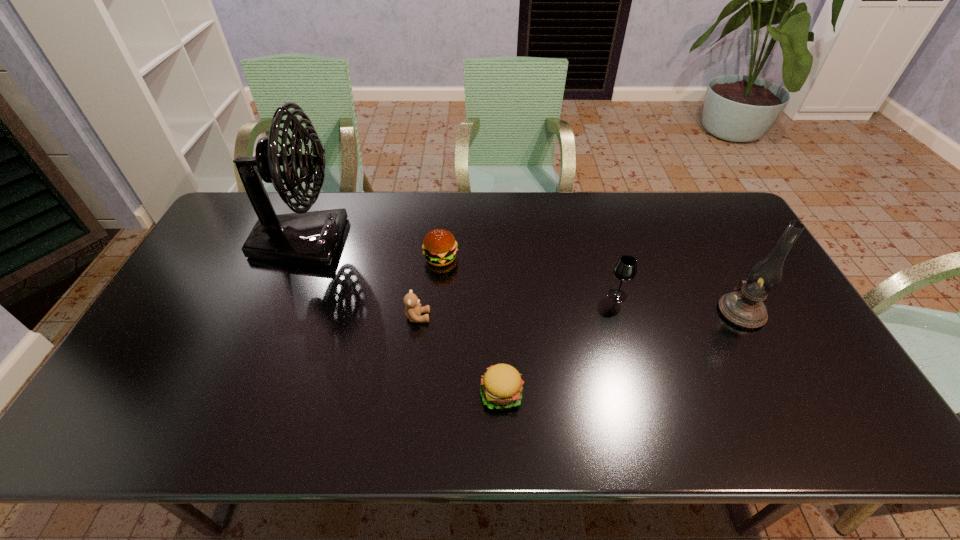
This screenshot has width=960, height=540. Find the location of `vacant area in the image that satisfies the following two spatial constraints: 1. in front of the shortest object to blow air; 2. on the left side of the tallest object`. vacant area in the image that satisfies the following two spatial constraints: 1. in front of the shortest object to blow air; 2. on the left side of the tallest object is located at coordinates (237, 393).

Where is `free point that satisfies the following two spatial constraints: 1. on the front-facing side of the teddy bear; 2. on the right side of the shortest object`? free point that satisfies the following two spatial constraints: 1. on the front-facing side of the teddy bear; 2. on the right side of the shortest object is located at coordinates (408, 393).

Find the location of a particular element. The height and width of the screenshot is (540, 960). vacant space that satisfies the following two spatial constraints: 1. in front of the nearest object to blow air; 2. on the right side of the tallest object is located at coordinates (237, 393).

Where is `vacant space that satisfies the following two spatial constraints: 1. in front of the shorter hamburger to blow air; 2. on the left side of the leftmost object`? vacant space that satisfies the following two spatial constraints: 1. in front of the shorter hamburger to blow air; 2. on the left side of the leftmost object is located at coordinates (237, 393).

Image resolution: width=960 pixels, height=540 pixels. I want to click on vacant area that satisfies the following two spatial constraints: 1. on the front side of the left hamburger; 2. on the front-facing side of the teddy bear, so click(436, 317).

At what (x,y) coordinates should I click in order to perform the action: click on free space that satisfies the following two spatial constraints: 1. in front of the tallest object to blow air; 2. on the back side of the farther hamburger. Please return your answer as a coordinate pair (x, y). The width and height of the screenshot is (960, 540). Looking at the image, I should click on (294, 258).

Where is `free location that satisfies the following two spatial constraints: 1. on the back side of the nearest object; 2. on the front-facing side of the teddy bear`? This screenshot has height=540, width=960. free location that satisfies the following two spatial constraints: 1. on the back side of the nearest object; 2. on the front-facing side of the teddy bear is located at coordinates 499,317.